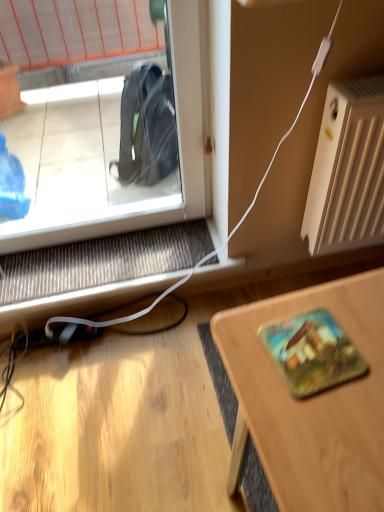
Question: Does wooden desk at lower right turn towards white matte radiator at right?

Choices:
 (A) no
 (B) yes

Answer: (A)

Question: From the image's perspective, is wooden desk at lower right on white matte radiator at right?

Choices:
 (A) no
 (B) yes

Answer: (A)

Question: Considering the relative positions of wooden desk at lower right and white matte radiator at right in the image provided, is wooden desk at lower right to the right of white matte radiator at right from the viewer's perspective?

Choices:
 (A) no
 (B) yes

Answer: (A)

Question: Is white matte radiator at right a part of wooden desk at lower right?

Choices:
 (A) no
 (B) yes

Answer: (A)

Question: From a real-world perspective, is wooden desk at lower right beneath white matte radiator at right?

Choices:
 (A) yes
 (B) no

Answer: (A)

Question: Is wooden desk at lower right not close to white matte radiator at right?

Choices:
 (A) no
 (B) yes

Answer: (A)

Question: Does white matte radiator at right have a lesser height compared to wooden desk at lower right?

Choices:
 (A) yes
 (B) no

Answer: (A)

Question: Can you confirm if white matte radiator at right is thinner than wooden desk at lower right?

Choices:
 (A) no
 (B) yes

Answer: (B)

Question: From the image's perspective, would you say white matte radiator at right is positioned over wooden desk at lower right?

Choices:
 (A) yes
 (B) no

Answer: (A)

Question: Is wooden desk at lower right a part of white matte radiator at right?

Choices:
 (A) yes
 (B) no

Answer: (B)

Question: Can you confirm if white matte radiator at right is wider than wooden desk at lower right?

Choices:
 (A) yes
 (B) no

Answer: (B)

Question: Is white matte radiator at right outside wooden desk at lower right?

Choices:
 (A) yes
 (B) no

Answer: (A)

Question: Is white matte radiator at right in front of or behind wooden desk at lower right in the image?

Choices:
 (A) front
 (B) behind

Answer: (B)